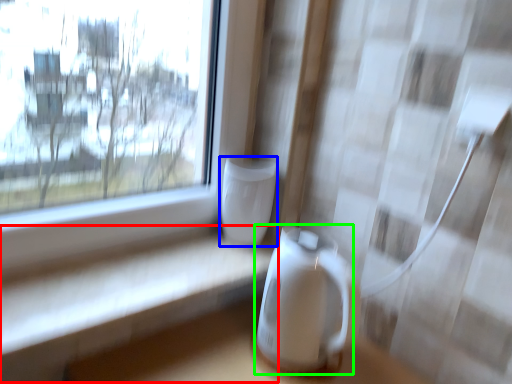
Question: Which object is positioned closest to table (highlighted by a red box)? Select from appliance (highlighted by a blue box) and appliance (highlighted by a green box).

Choices:
 (A) appliance
 (B) appliance

Answer: (B)